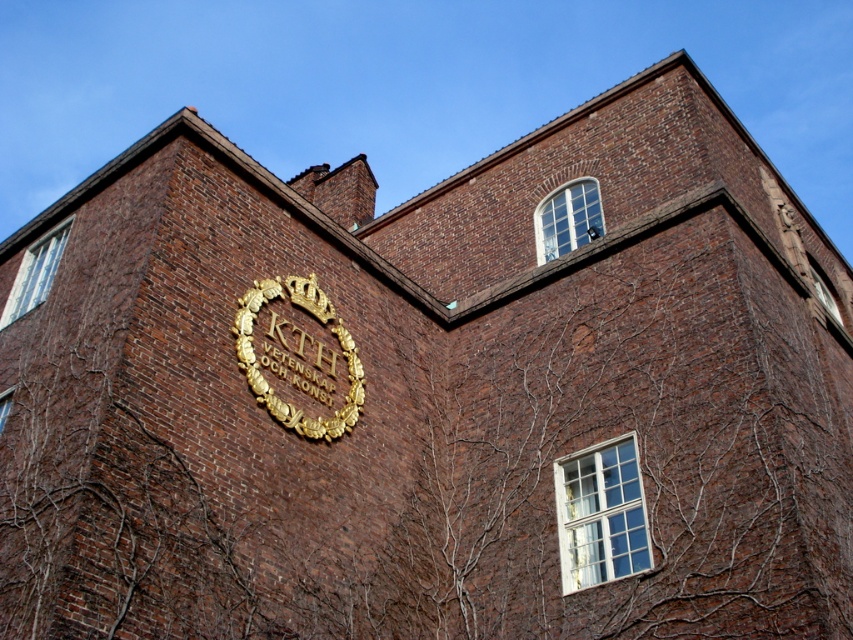
Question: Considering the relative positions of clear glass window at upper center and clear glass window at lower left in the image provided, where is clear glass window at upper center located with respect to clear glass window at lower left?

Choices:
 (A) left
 (B) right

Answer: (B)

Question: Is goldmaterial/texturekth emblem at center wider than white glass window at center?

Choices:
 (A) yes
 (B) no

Answer: (A)

Question: Is goldmaterial/texturekth emblem at center behind clear glass window at lower left?

Choices:
 (A) yes
 (B) no

Answer: (B)

Question: Among these objects, which one is nearest to the camera?

Choices:
 (A) clear glass window at upper center
 (B) goldmaterial/texturekth emblem at center

Answer: (B)

Question: Considering the real-world distances, which object is farthest from the white glass window at center?

Choices:
 (A) clear glass window at upper center
 (B) goldmaterial/texturekth emblem at center

Answer: (A)

Question: Which is farther from the clear glass window at lower left?

Choices:
 (A) white glass window at center
 (B) white glass window at upper left

Answer: (A)